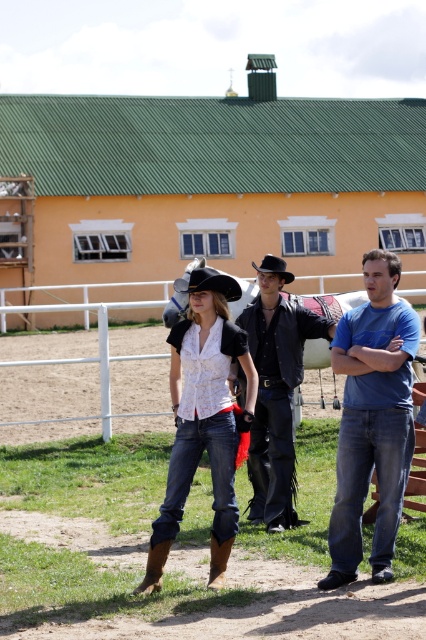
Measure the distance between point [201,323] and camera.

Result: The distance of point [201,323] from camera is 27.84 feet.

Which is above, denim jeans at center or white glossy horse at center?

white glossy horse at center is higher up.

Find the location of a particular element. The height and width of the screenshot is (640, 426). denim jeans at center is located at coordinates (203, 412).

Which is in front, point (210, 269) or point (262, 262)?

Point (210, 269) is in front.

How much distance is there between black felt cowboy hat at center and black leather cowboy hat at center?

The distance of black felt cowboy hat at center from black leather cowboy hat at center is 2.84 meters.

Locate an element on the screen. The width and height of the screenshot is (426, 640). black felt cowboy hat at center is located at coordinates (209, 282).

Between point (331, 316) and point (149, 566), which one is positioned in front?

Point (149, 566)

Is point (347, 296) in front of point (152, 552)?

No.

Which is in front, point (183, 296) or point (169, 540)?

Point (169, 540) is in front.

Find the location of `white glossy horse at center`. white glossy horse at center is located at coordinates (328, 301).